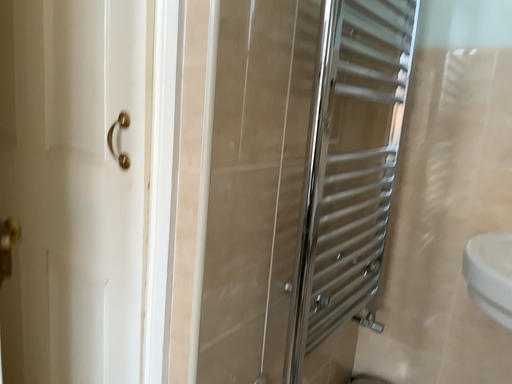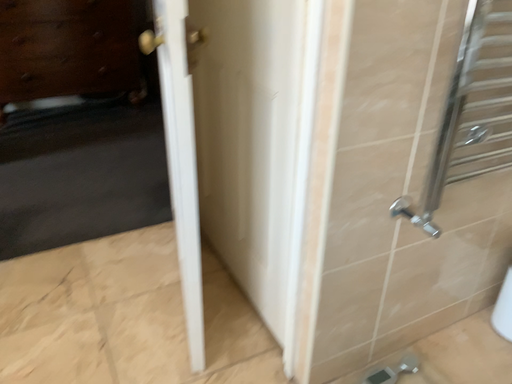
Question: How did the camera likely rotate when shooting the video?

Choices:
 (A) rotated right
 (B) rotated left

Answer: (B)